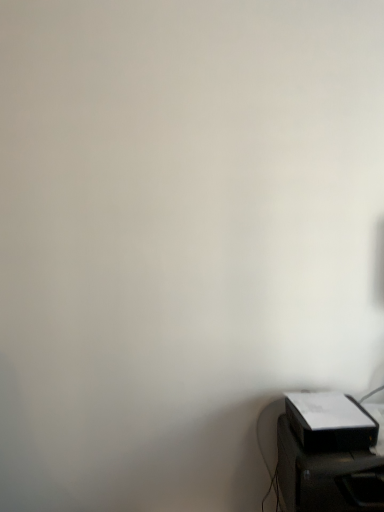
Question: From the image's perspective, is white matte printer at lower right positioned above or below black plastic printer at lower right?

Choices:
 (A) above
 (B) below

Answer: (A)

Question: Do you think white matte printer at lower right is within black plastic printer at lower right, or outside of it?

Choices:
 (A) outside
 (B) inside

Answer: (A)

Question: From their relative heights in the image, would you say white matte printer at lower right is taller or shorter than black plastic printer at lower right?

Choices:
 (A) tall
 (B) short

Answer: (B)

Question: Is black plastic printer at lower right bigger or smaller than white matte printer at lower right?

Choices:
 (A) small
 (B) big

Answer: (B)

Question: From the image's perspective, is black plastic printer at lower right positioned above or below white matte printer at lower right?

Choices:
 (A) above
 (B) below

Answer: (B)

Question: Looking at their shapes, would you say black plastic printer at lower right is wider or thinner than white matte printer at lower right?

Choices:
 (A) thin
 (B) wide

Answer: (B)

Question: Is black plastic printer at lower right taller or shorter than white matte printer at lower right?

Choices:
 (A) tall
 (B) short

Answer: (A)